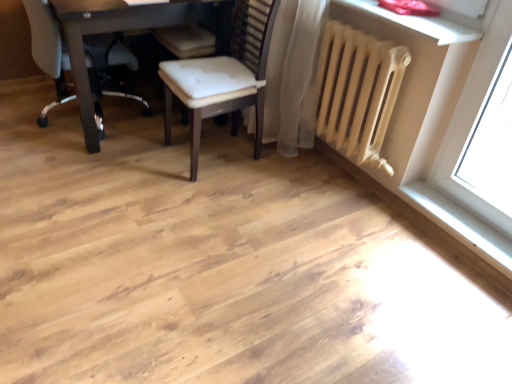
At what (x,y) coordinates should I click in order to perform the action: click on free space in front of white leather chair at upper left, acting as the 2th chair starting from the right. Please return your answer as a coordinate pair (x, y). This screenshot has height=384, width=512. Looking at the image, I should click on (72, 170).